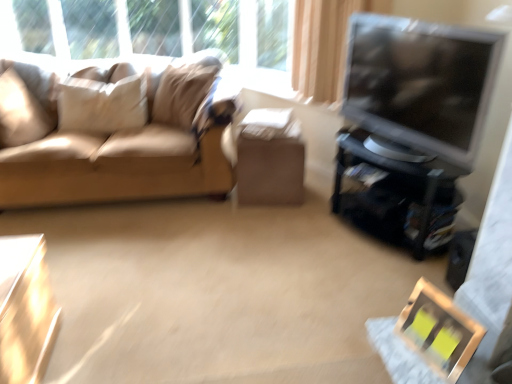
At what (x,y) coordinates should I click in order to perform the action: click on vacant space that is in between shiny metallic table at lower left, the second table viewed from the back, and wooden picture frame at lower right. Please return your answer as a coordinate pair (x, y). This screenshot has height=384, width=512. Looking at the image, I should click on (212, 349).